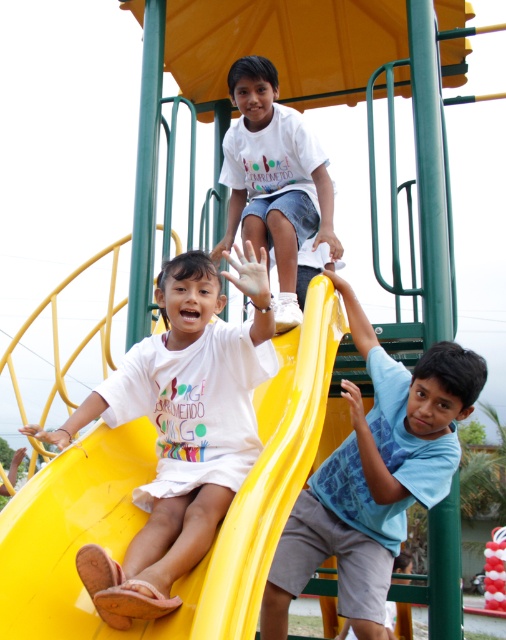
Is yellow plastic slide at center above blue printed shirt at upper right?

Yes.

Is the position of yellow plastic slide at center less distant than that of blue printed shirt at upper right?

Yes, yellow plastic slide at center is in front of blue printed shirt at upper right.

Which is in front, point (45, 621) or point (436, 500)?

Point (45, 621) is more forward.

You are a GUI agent. You are given a task and a screenshot of the screen. Output one action in this format:
    pyautogui.click(x=<x>, y=<y>)
    Task: Click on the yellow plastic slide at center
    The image size is (506, 640).
    Given the screenshot: What is the action you would take?
    pyautogui.click(x=146, y=515)

Is yellow plastic slide at center thinner than white cotton shirt at upper center?

Yes, yellow plastic slide at center is thinner than white cotton shirt at upper center.

Which of these two, yellow plastic slide at center or white cotton shirt at upper center, stands taller?

Standing taller between the two is white cotton shirt at upper center.

Describe the element at coordinates (146, 515) in the screenshot. This screenshot has height=640, width=506. I see `yellow plastic slide at center` at that location.

The width and height of the screenshot is (506, 640). In order to click on yellow plastic slide at center in this screenshot , I will do `click(146, 515)`.

Is blue printed shirt at upper right to the right of white cotton shirt at upper center from the viewer's perspective?

Indeed, blue printed shirt at upper right is positioned on the right side of white cotton shirt at upper center.

Is blue printed shirt at upper right smaller than white cotton shirt at upper center?

Indeed, blue printed shirt at upper right has a smaller size compared to white cotton shirt at upper center.

Does point (375, 563) come behind point (297, 148)?

No, (375, 563) is closer to viewer.

The width and height of the screenshot is (506, 640). In order to click on blue printed shirt at upper right in this screenshot , I will do (362, 461).